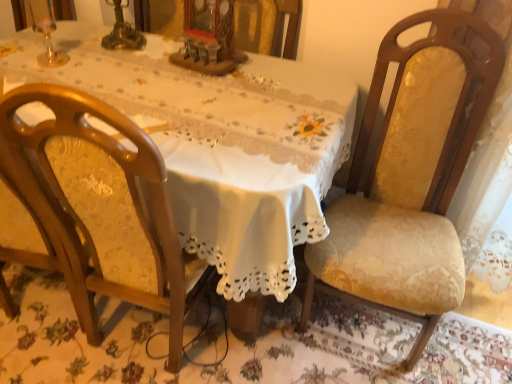
Locate an element on the screen. This screenshot has width=512, height=384. unoccupied region to the right of wooden chair at left, which ranks as the 2th chair in right-to-left order is located at coordinates click(x=256, y=350).